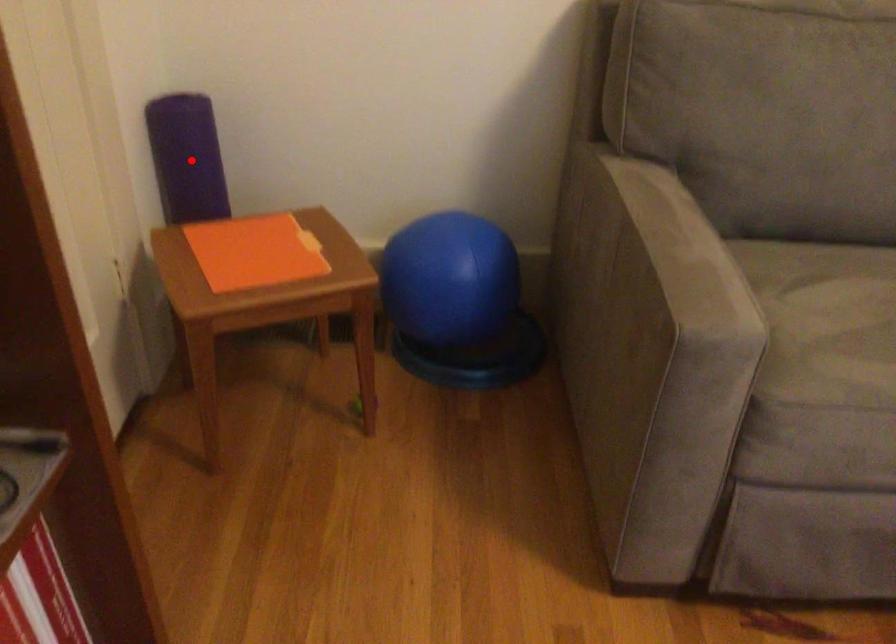
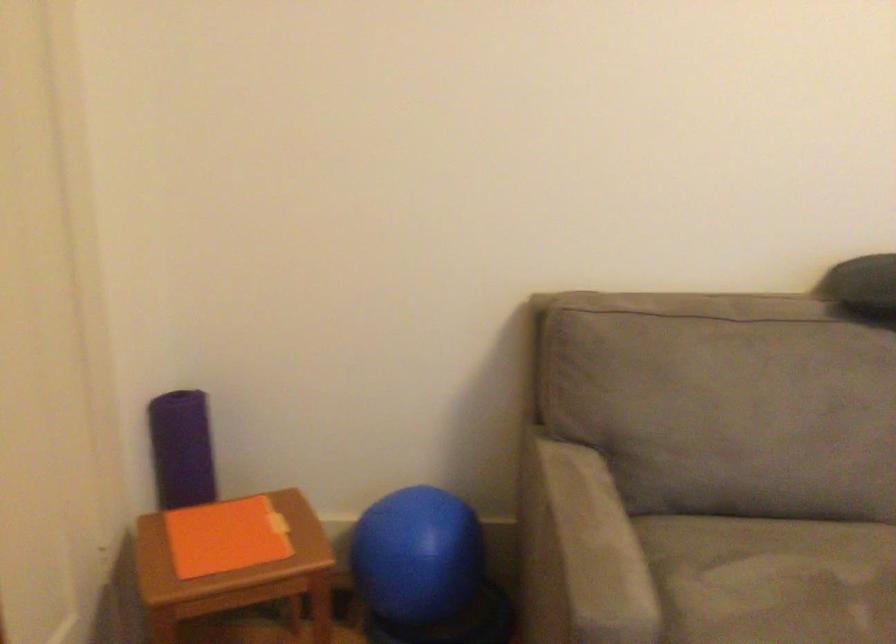
Locate, in the second image, the point that corresponds to the highlighted location in the first image.

(182, 449)